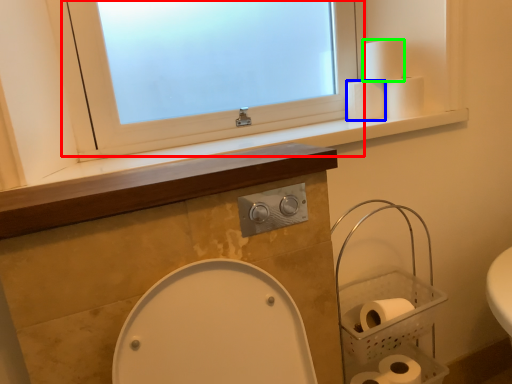
Question: Based on their relative distances, which object is farther from window (highlighted by a red box)? Choose from toilet paper (highlighted by a blue box) and toilet paper (highlighted by a green box).

Choices:
 (A) toilet paper
 (B) toilet paper

Answer: (B)